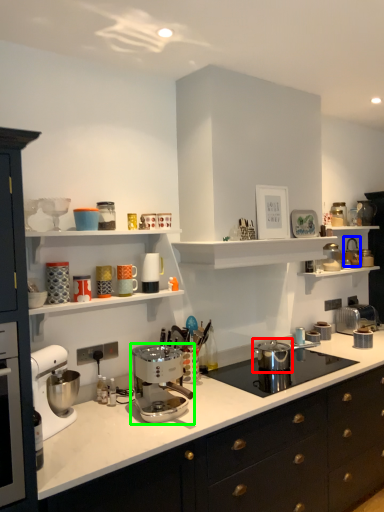
Question: Considering the real-world distances, which object is closest to kitchen appliance (highlighted by a red box)? appliance (highlighted by a blue box) or mixer (highlighted by a green box).

Choices:
 (A) appliance
 (B) mixer

Answer: (B)